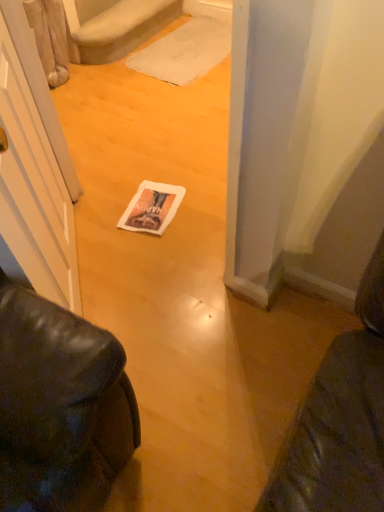
Question: Considering the relative positions of white paper magazine at center and white plush carpet at upper center in the image provided, is white paper magazine at center to the left or to the right of white plush carpet at upper center?

Choices:
 (A) left
 (B) right

Answer: (B)

Question: Is white paper magazine at center inside or outside of white plush carpet at upper center?

Choices:
 (A) outside
 (B) inside

Answer: (A)

Question: Which object is the farthest from the white fabric doormat at center?

Choices:
 (A) white plush carpet at upper center
 (B) white paper magazine at center

Answer: (B)

Question: Which object is positioned closest to the white fabric doormat at center?

Choices:
 (A) white paper magazine at center
 (B) white plush carpet at upper center

Answer: (B)